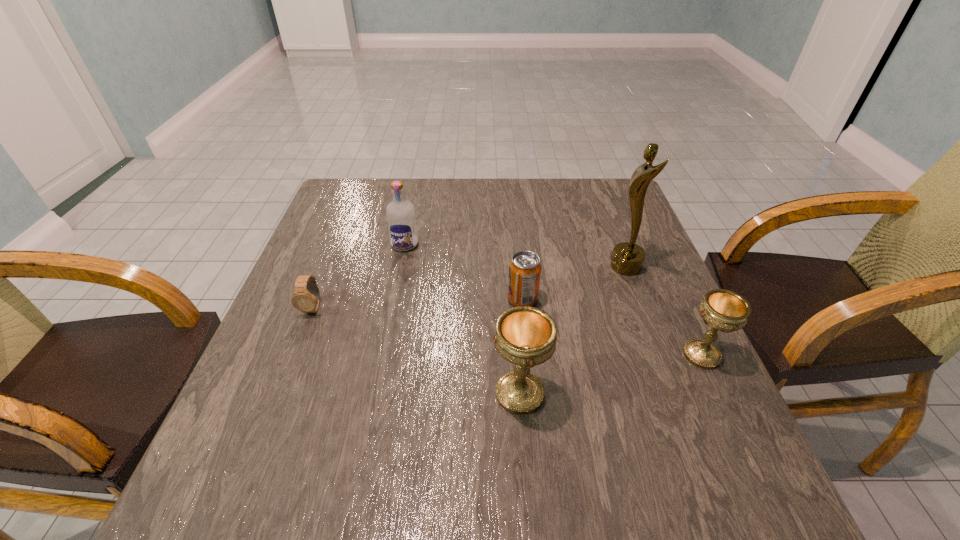
At what (x,y) coordinates should I click in order to perform the action: click on the left chalice. Please return your answer as a coordinate pair (x, y). Looking at the image, I should click on (526, 336).

Find the location of a particular element. The width and height of the screenshot is (960, 540). the shorter chalice is located at coordinates (724, 310).

Where is `the right chalice`? This screenshot has width=960, height=540. the right chalice is located at coordinates tap(724, 310).

Image resolution: width=960 pixels, height=540 pixels. I want to click on the second object from left to right, so (x=400, y=213).

Where is `the fifth object from left to right`? The image size is (960, 540). the fifth object from left to right is located at coordinates (627, 258).

Identify the location of award. (627, 258).

Locate an element on the screen. The height and width of the screenshot is (540, 960). soda can is located at coordinates (525, 268).

Identify the location of the shortest object. This screenshot has width=960, height=540. (306, 298).

This screenshot has height=540, width=960. I want to click on the leftmost object, so click(306, 298).

I want to click on vacant area situated on the left of the taller chalice, so click(318, 394).